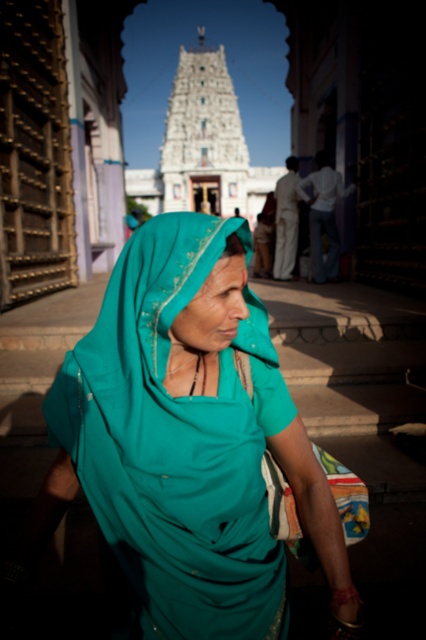
Question: Is teal fabric headscarf at center positioned before light brown cotton robe at center?

Choices:
 (A) no
 (B) yes

Answer: (B)

Question: Does teal fabric headscarf at center lie behind light brown cotton robe at center?

Choices:
 (A) no
 (B) yes

Answer: (A)

Question: Which object is closer to the camera taking this photo?

Choices:
 (A) light brown cotton robe at center
 (B) teal fabric headscarf at center

Answer: (B)

Question: Which of the following is the closest to the observer?

Choices:
 (A) light brown cotton robe at center
 (B) teal fabric headscarf at center

Answer: (B)

Question: Which of the following is the farthest from the observer?

Choices:
 (A) (296, 417)
 (B) (275, 276)

Answer: (B)

Question: Is teal fabric headscarf at center below light brown cotton robe at center?

Choices:
 (A) no
 (B) yes

Answer: (B)